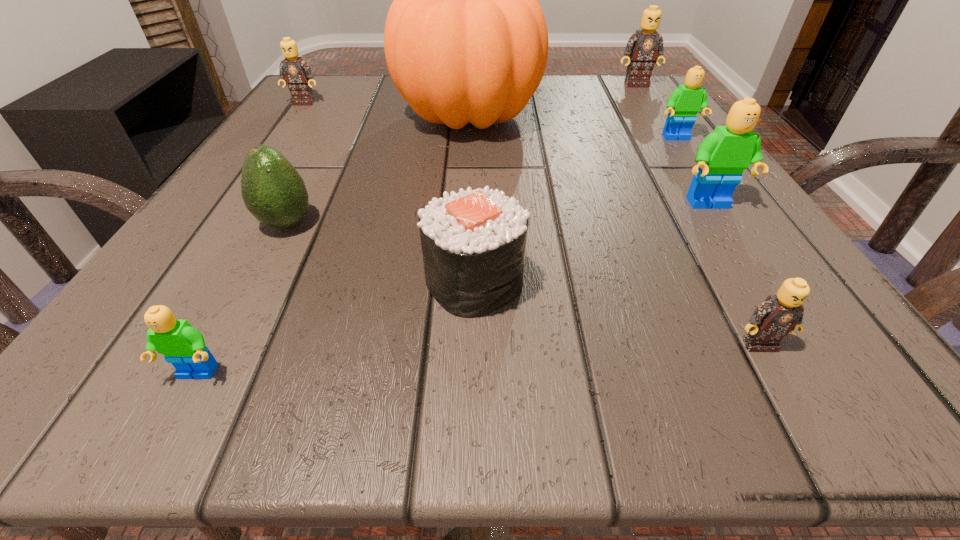
Locate which green Lego ranks second in proximity to the green avocado. Please provide its 2D coordinates. Your answer should be formatted as a tuple, i.e. [(x, y)], where the tuple contains the x and y coordinates of a point satisfying the conditions above.

[(723, 155)]

Locate which green Lego ranks in proximity to the fifth Lego from right to left. Please provide its 2D coordinates. Your answer should be formatted as a tuple, i.e. [(x, y)], where the tuple contains the x and y coordinates of a point satisfying the conditions above.

[(723, 155)]